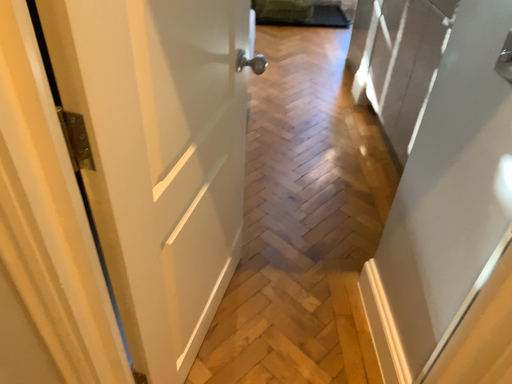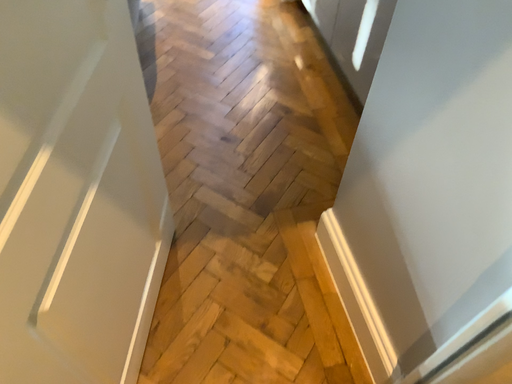
Question: Which way did the camera rotate in the video?

Choices:
 (A) rotated downward
 (B) rotated upward

Answer: (A)